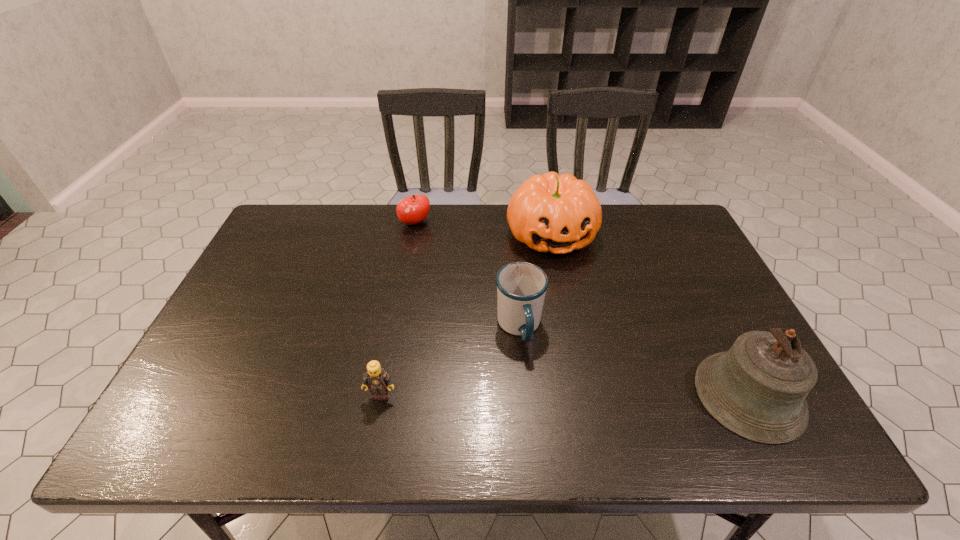
This screenshot has height=540, width=960. In the image, there is a desktop. What are the coordinates of `vacant space at the near edge` in the screenshot? It's located at (680, 388).

At what (x,y) coordinates should I click in order to perform the action: click on vacant space at the left edge of the desktop. Please return your answer as a coordinate pair (x, y). The height and width of the screenshot is (540, 960). Looking at the image, I should click on (231, 296).

In the image, there is a desktop. Where is `free space at the far right corner`? This screenshot has height=540, width=960. free space at the far right corner is located at coordinates (653, 218).

Identify the location of vacant area between the Lego and the apple. (398, 309).

Locate an element on the screen. empty space between the pumpkin and the apple is located at coordinates (483, 229).

At what (x,y) coordinates should I click in order to perform the action: click on free area in between the apple and the mug. Please return your answer as a coordinate pair (x, y). Looking at the image, I should click on (467, 275).

Where is `vacant point located between the Lego and the rightmost object`? This screenshot has height=540, width=960. vacant point located between the Lego and the rightmost object is located at coordinates (565, 395).

Locate an element on the screen. This screenshot has width=960, height=540. free space between the pumpkin and the Lego is located at coordinates (467, 315).

Locate an element on the screen. The width and height of the screenshot is (960, 540). vacant area that lies between the third shortest object and the bell is located at coordinates (635, 361).

At what (x,y) coordinates should I click in order to perform the action: click on free space that is in between the pumpkin and the rightmost object. Please return your answer as a coordinate pair (x, y). Looking at the image, I should click on (650, 315).